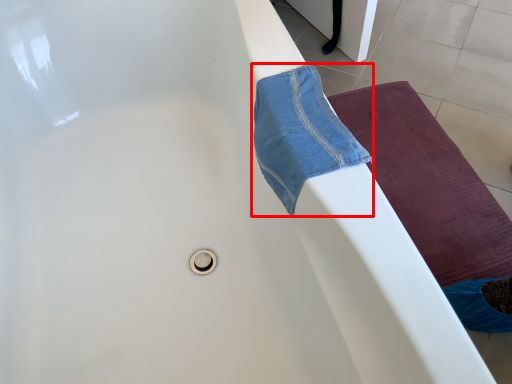
Question: Considering the relative positions of beach towel (annotated by the red box) and yoga mat in the image provided, where is beach towel (annotated by the red box) located with respect to the staircase?

Choices:
 (A) right
 (B) left

Answer: (B)